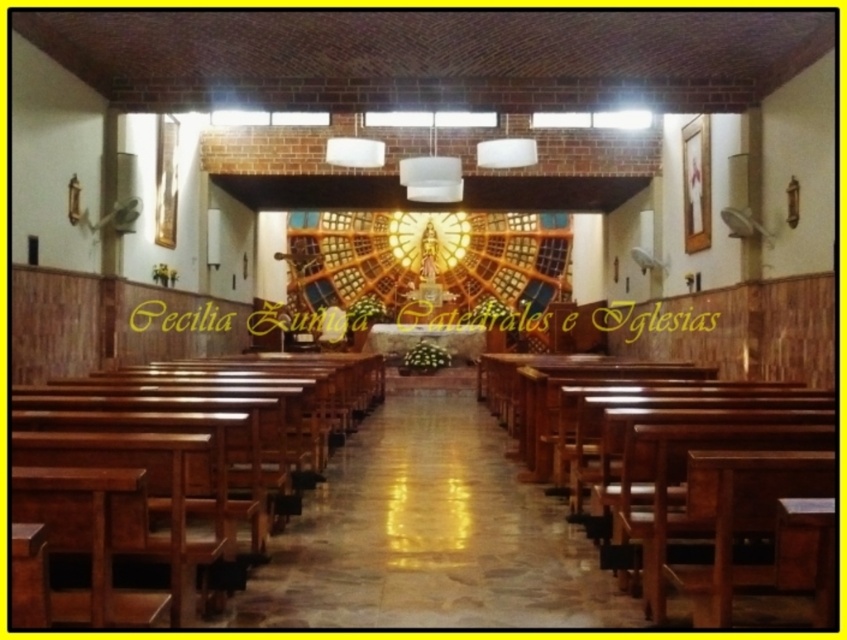
Question: Which object appears closest to the camera in this image?

Choices:
 (A) wooden church bench at center
 (B) polished wood church bench at center

Answer: (A)

Question: Is wooden church bench at center above polished wood church bench at center?

Choices:
 (A) yes
 (B) no

Answer: (B)

Question: Which point is closer to the camera taking this photo?

Choices:
 (A) (15, 502)
 (B) (662, 468)

Answer: (A)

Question: Does wooden church bench at center appear over polished wood church bench at center?

Choices:
 (A) yes
 (B) no

Answer: (B)

Question: Which point appears closest to the camera in this image?

Choices:
 (A) (745, 390)
 (B) (68, 500)

Answer: (B)

Question: Can you confirm if wooden church bench at center is positioned to the left of polished wood church bench at center?

Choices:
 (A) yes
 (B) no

Answer: (A)